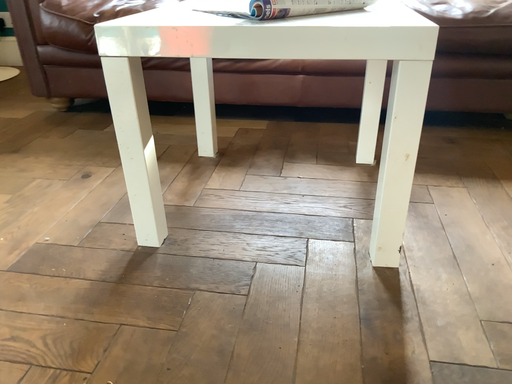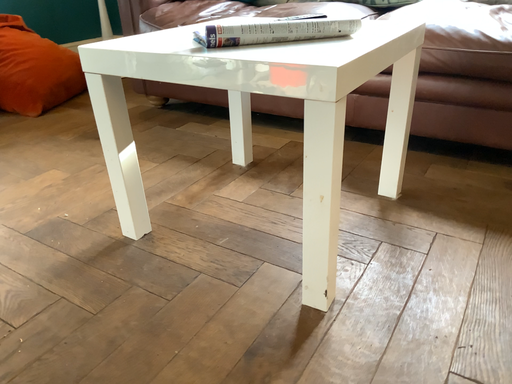
Question: Which way did the camera rotate in the video?

Choices:
 (A) rotated right
 (B) rotated left

Answer: (B)